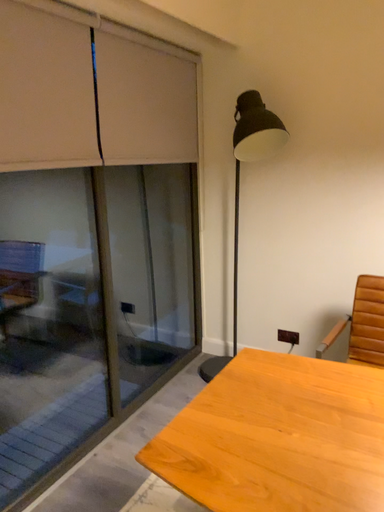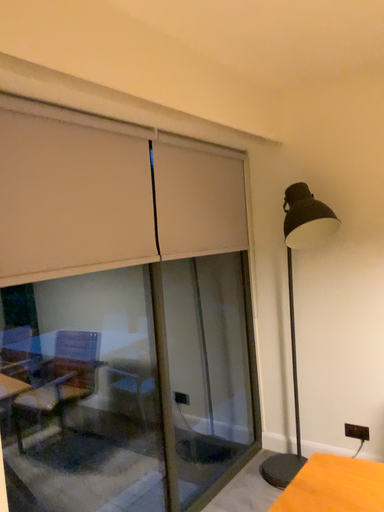
Question: Which way did the camera rotate in the video?

Choices:
 (A) rotated downward
 (B) rotated upward

Answer: (B)